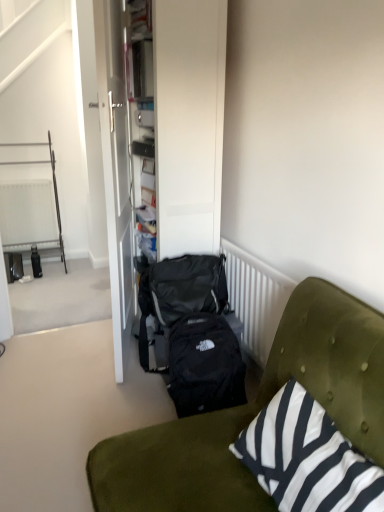
You are a GUI agent. You are given a task and a screenshot of the screen. Output one action in this format:
    pyautogui.click(x=<x>, y=<y>)
    Task: Click on the vacant area on top of white textured radiator at left, which appears as the 1th radiator when viewed from the top (from a real-world perspective)
    
    Given the screenshot: What is the action you would take?
    pyautogui.click(x=22, y=179)